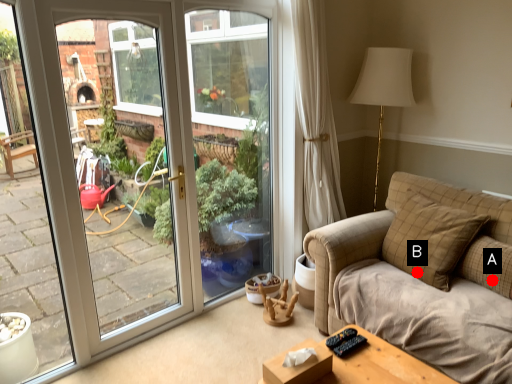
Question: Two points are circled on the image, labeled by A and B beside each circle. Among these points, which one is farthest from the camera?

Choices:
 (A) A is further
 (B) B is further

Answer: (B)